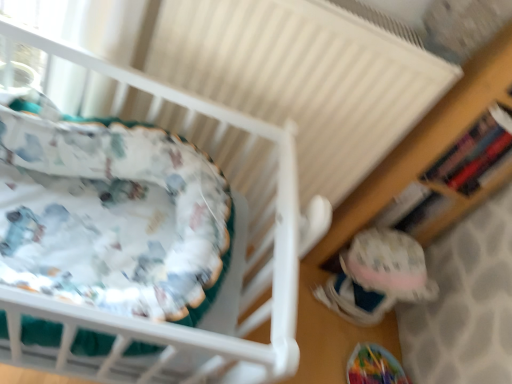
Find the location of `empty space that is ontop of fuzzy fabric toy at lower right`. empty space that is ontop of fuzzy fabric toy at lower right is located at coordinates (376, 252).